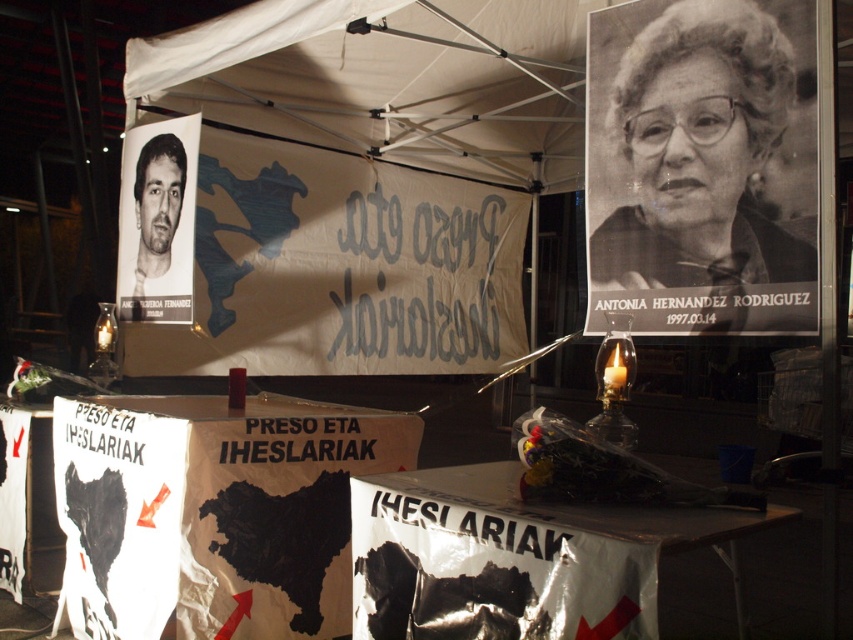
You are organizing a memorial event and need to place a new sign between the white paper map at center and the matte black photo at upper left. Which object should you place the sign closer to if you want it to be near the wider object?

The white paper map at center might be wider than matte black photo at upper left, so you should place the sign closer to the white paper map at center.

You are organizing a memorial event and need to place a new sign between the white paper map at center and the matte black photo at upper left. Based on their positions, which object should the new sign be placed closer to?

The white paper map at center is to the right of the matte black photo at upper left, so the new sign should be placed closer to the matte black photo at upper left to maintain the leftward arrangement.

You are an event organizer who needs to adjust the layout of the memorial. You notice the white paper poster at left and the matte black photo at upper left. Which object is closer to the viewer?

The white paper poster at left is closer to the viewer because the matte black photo at upper left is behind it.